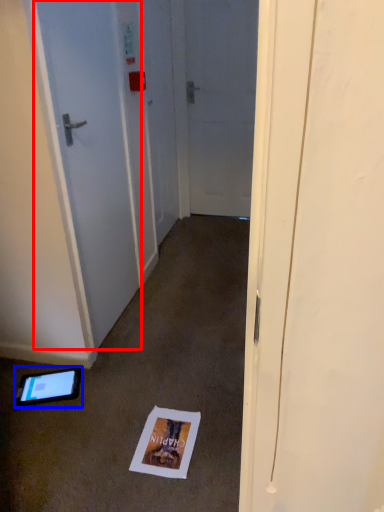
Question: Among these objects, which one is nearest to the camera, door (highlighted by a red box) or tablet computer (highlighted by a blue box)?

Choices:
 (A) door
 (B) tablet computer

Answer: (A)